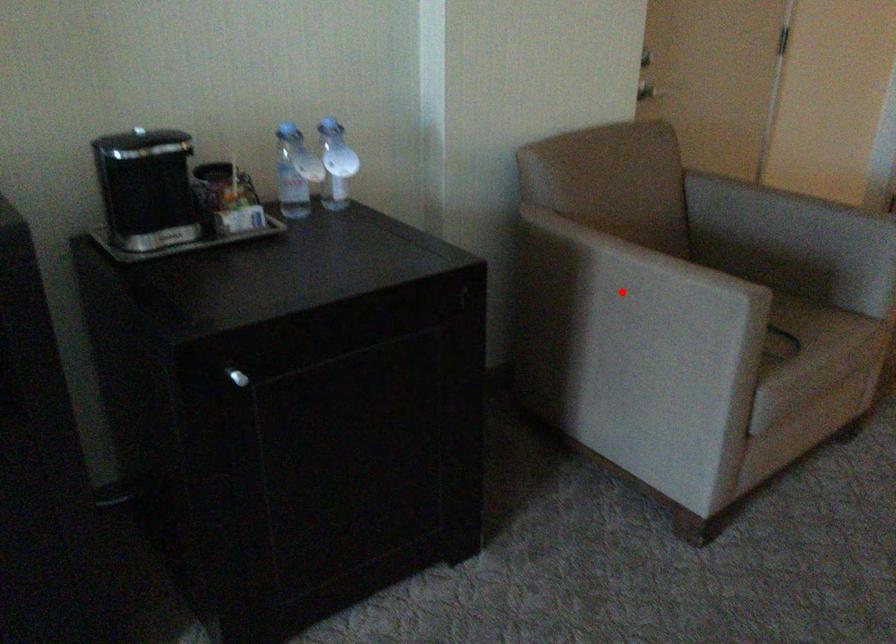
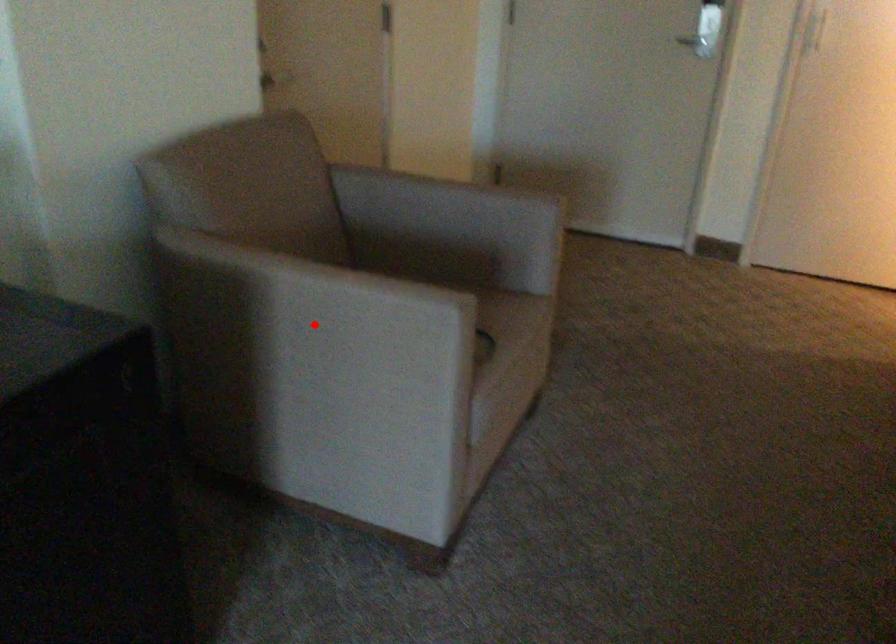
I am providing you with two images of the same scene from different viewpoints. A red point is marked on the first image and another point is marked on the second image. Are the points marked in image1 and image2 representing the same 3D position?

Yes